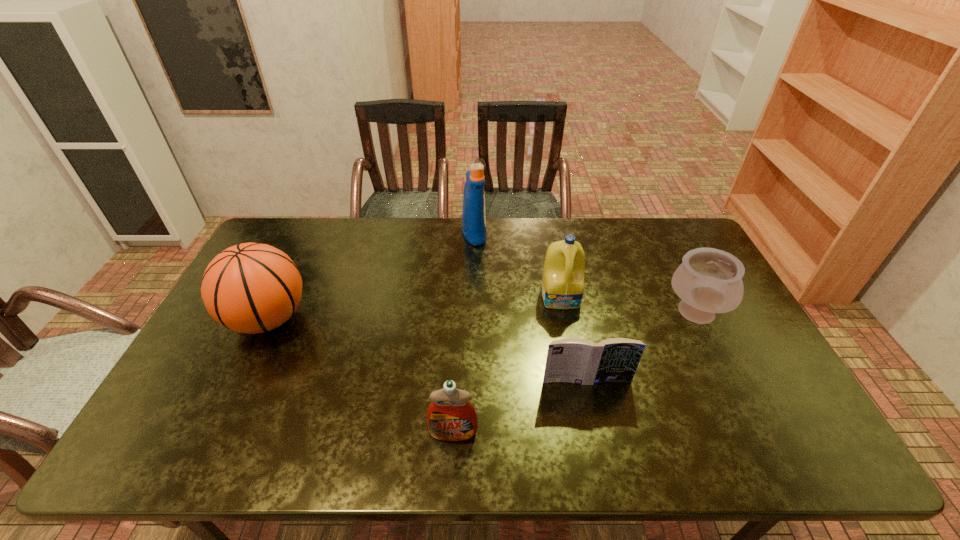
This screenshot has height=540, width=960. Identify the location of the tallest object. (473, 213).

Where is `the farthest object`? Image resolution: width=960 pixels, height=540 pixels. the farthest object is located at coordinates (473, 213).

This screenshot has height=540, width=960. I want to click on basketball, so click(x=252, y=288).

The height and width of the screenshot is (540, 960). Find the location of `the second farthest detergent`. the second farthest detergent is located at coordinates 563,276.

This screenshot has height=540, width=960. I want to click on the rightmost object, so click(x=709, y=281).

At what (x,y) coordinates should I click in order to perform the action: click on the nearest object. Please return your answer as a coordinate pair (x, y). Image resolution: width=960 pixels, height=540 pixels. Looking at the image, I should click on (451, 417).

This screenshot has height=540, width=960. Find the location of `the nearest detergent`. the nearest detergent is located at coordinates (451, 417).

You are a GUI agent. You are given a task and a screenshot of the screen. Output one action in this format:
    pyautogui.click(x=<x>, y=<y>)
    Task: Click on the fifth farthest object
    
    Given the screenshot: What is the action you would take?
    pyautogui.click(x=574, y=360)

You are a GUI agent. You are given a task and a screenshot of the screen. Output one action in this format:
    pyautogui.click(x=<x>, y=<y>)
    Task: Click on the book
    
    Given the screenshot: What is the action you would take?
    pyautogui.click(x=574, y=360)

Locate an element on the screen. This screenshot has width=960, height=540. free space located on the label of the tallest detergent is located at coordinates (519, 233).